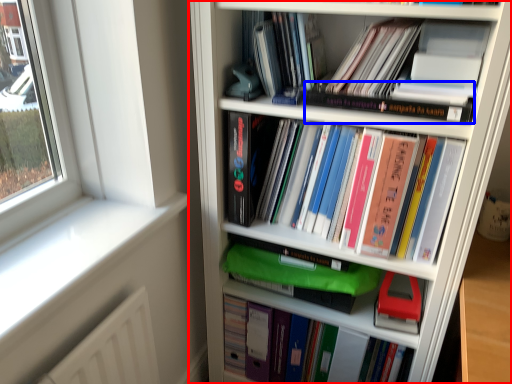
Question: Which object is further to the camera taking this photo, bookcase (highlighted by a red box) or book (highlighted by a blue box)?

Choices:
 (A) bookcase
 (B) book

Answer: (B)